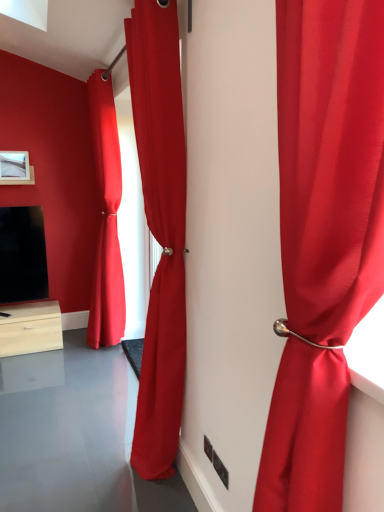
Question: Does satin red curtain at center, the 2th curtain viewed from the back, have a smaller size compared to satin red curtain at center, which appears as the 3th curtain when viewed from the right?

Choices:
 (A) yes
 (B) no

Answer: (B)

Question: Could satin red curtain at center, which is counted as the first curtain, starting from the left, be considered to be inside satin red curtain at center, arranged as the 2th curtain when viewed from the left?

Choices:
 (A) yes
 (B) no

Answer: (B)

Question: Can you confirm if satin red curtain at center, which ranks as the 2th curtain in right-to-left order, is positioned to the right of satin red curtain at center, which is counted as the first curtain, starting from the left?

Choices:
 (A) yes
 (B) no

Answer: (A)

Question: Can you confirm if satin red curtain at center, which ranks as the 2th curtain in right-to-left order, is positioned to the left of satin red curtain at center, which appears as the 3th curtain when viewed from the right?

Choices:
 (A) yes
 (B) no

Answer: (B)

Question: Is satin red curtain at center, the 2th curtain positioned from the front, next to satin red curtain at center, which appears as the 3th curtain when viewed from the right?

Choices:
 (A) no
 (B) yes

Answer: (A)

Question: Choose the correct answer: Is satin red curtain at center, which is the first curtain from back to front, inside satin red curtain at center, the 2th curtain viewed from the back, or outside it?

Choices:
 (A) inside
 (B) outside

Answer: (B)

Question: Is satin red curtain at center, which is the first curtain from back to front, wider or thinner than satin red curtain at center, the 2th curtain positioned from the front?

Choices:
 (A) thin
 (B) wide

Answer: (A)

Question: From the image's perspective, is satin red curtain at center, which appears as the 3th curtain when viewed from the right, positioned above or below satin red curtain at center, which ranks as the 2th curtain in right-to-left order?

Choices:
 (A) below
 (B) above

Answer: (B)

Question: Does point (119, 181) appear closer or farther from the camera than point (129, 52)?

Choices:
 (A) farther
 (B) closer

Answer: (A)

Question: Considering the positions of satin red curtain at center, which appears as the 3th curtain when viewed from the right, and satin red curtain at right, which is counted as the 3th curtain, starting from the back, in the image, is satin red curtain at center, which appears as the 3th curtain when viewed from the right, wider or thinner than satin red curtain at right, which is counted as the 3th curtain, starting from the back,?

Choices:
 (A) thin
 (B) wide

Answer: (B)

Question: From a real-world perspective, is satin red curtain at center, which is counted as the first curtain, starting from the left, above or below satin red curtain at right, placed as the first curtain when sorted from right to left?

Choices:
 (A) above
 (B) below

Answer: (B)

Question: From the image's perspective, is satin red curtain at center, which appears as the 3th curtain when viewed from the right, above or below satin red curtain at right, the third curtain positioned from the left?

Choices:
 (A) above
 (B) below

Answer: (A)

Question: Would you say satin red curtain at center, which appears as the 3th curtain when viewed from the right, is inside or outside satin red curtain at right, the third curtain positioned from the left?

Choices:
 (A) inside
 (B) outside

Answer: (B)

Question: Visually, is matte white picture frame at upper left positioned to the left or to the right of satin red curtain at center, the 2th curtain positioned from the front?

Choices:
 (A) left
 (B) right

Answer: (A)

Question: In terms of width, does matte white picture frame at upper left look wider or thinner when compared to satin red curtain at center, which ranks as the 2th curtain in right-to-left order?

Choices:
 (A) wide
 (B) thin

Answer: (B)